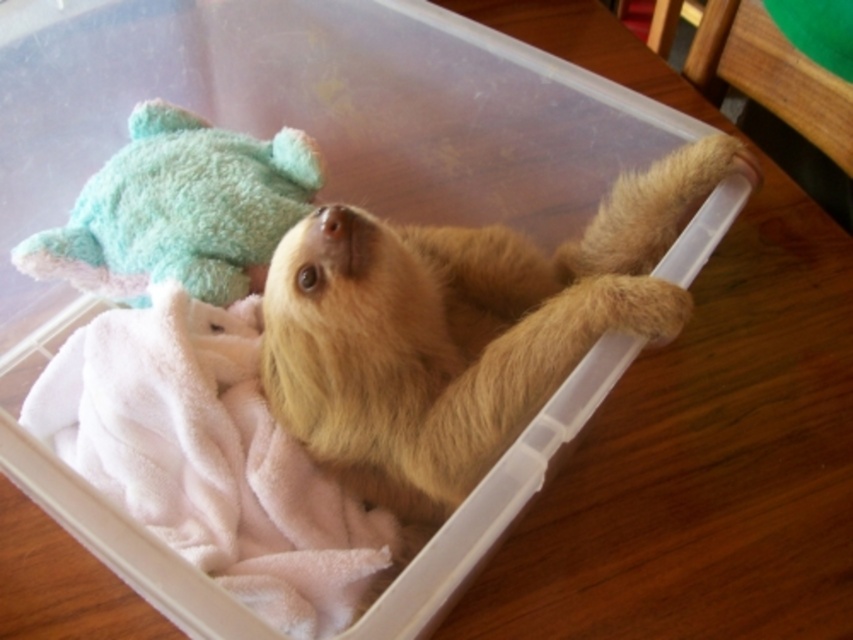
Does point (547, 300) come behind point (231, 236)?

No, it is not.

This screenshot has width=853, height=640. Find the location of `fuzzy golden sloth at center`. fuzzy golden sloth at center is located at coordinates (460, 326).